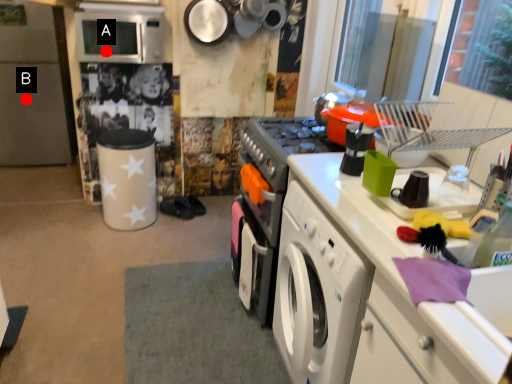
Question: Two points are circled on the image, labeled by A and B beside each circle. Among these points, which one is nearest to the camera?

Choices:
 (A) A is closer
 (B) B is closer

Answer: (A)